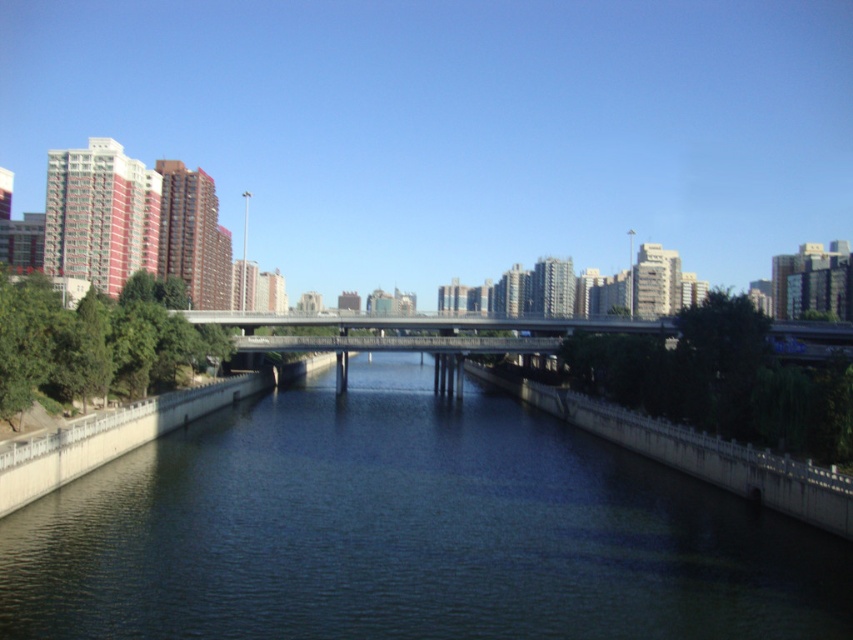
Question: Considering the relative positions of dark blue concrete river at center and metallic gray bridge at center in the image provided, where is dark blue concrete river at center located with respect to metallic gray bridge at center?

Choices:
 (A) above
 (B) below

Answer: (B)

Question: Is dark blue concrete river at center above metallic gray bridge at center?

Choices:
 (A) no
 (B) yes

Answer: (A)

Question: Which of the following is the closest to the observer?

Choices:
 (A) metallic gray bridge at center
 (B) dark blue concrete river at center

Answer: (B)

Question: Does dark blue concrete river at center have a larger size compared to metallic gray bridge at center?

Choices:
 (A) yes
 (B) no

Answer: (B)